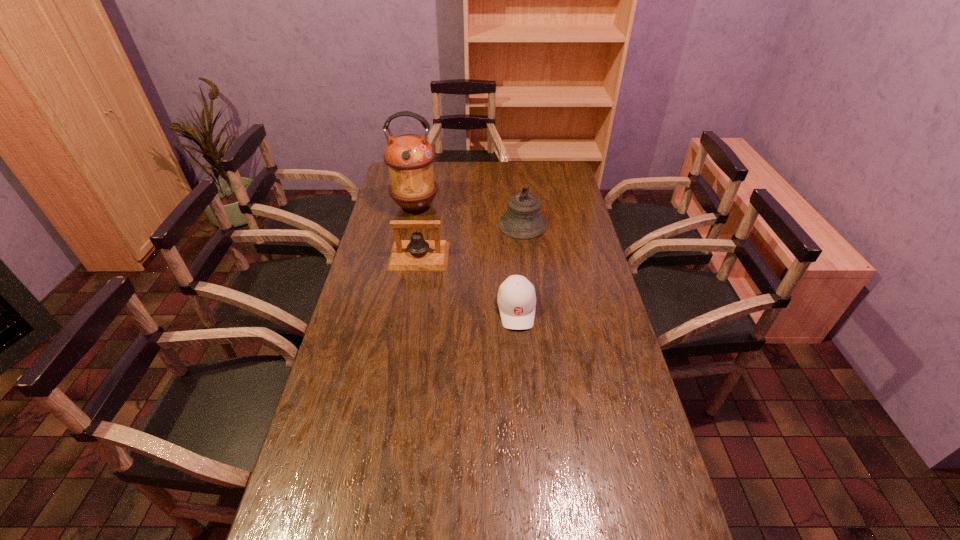
At what (x,y) coordinates should I click in order to perform the action: click on vacant space in between the oil lamp and the farther bell. Please return your answer as a coordinate pair (x, y). Looking at the image, I should click on (468, 215).

Find the location of a particular element. free spot between the right bell and the left bell is located at coordinates (470, 241).

Identify the location of vacant region between the farther bell and the shorter bell. (470, 241).

The height and width of the screenshot is (540, 960). Find the location of `free spot between the tallest object and the baseball cap`. free spot between the tallest object and the baseball cap is located at coordinates (466, 258).

Find the location of a particular element. The width and height of the screenshot is (960, 540). empty space between the shortest object and the tallest object is located at coordinates (466, 258).

You are a GUI agent. You are given a task and a screenshot of the screen. Output one action in this format:
    pyautogui.click(x=<x>, y=<y>)
    Task: Click on the vacant point located between the oil lamp and the shorter bell
    The height and width of the screenshot is (540, 960).
    Given the screenshot: What is the action you would take?
    pyautogui.click(x=418, y=231)

Choose which object is the third nearest neighbor to the third farthest object. Please provide its 2D coordinates. Your answer should be formatted as a tuple, i.e. [(x, y)], where the tuple contains the x and y coordinates of a point satisfying the conditions above.

[(516, 298)]

You are a GUI agent. You are given a task and a screenshot of the screen. Output one action in this format:
    pyautogui.click(x=<x>, y=<y>)
    Task: Click on the object that stands as the closest to the nearer bell
    This screenshot has height=540, width=960.
    Given the screenshot: What is the action you would take?
    coord(409,157)

Locate an element on the screen. The image size is (960, 540). blank space that satisfies the following two spatial constraints: 1. on the front side of the left bell; 2. on the right side of the tallest object is located at coordinates (405, 256).